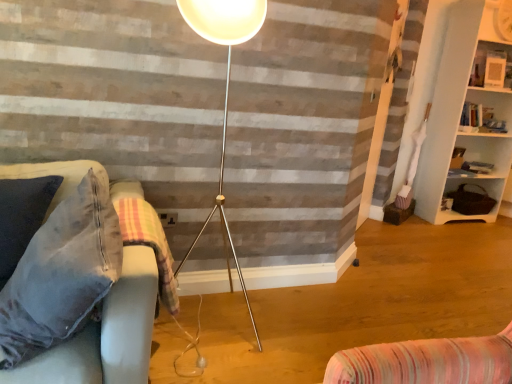
Question: Is the position of wooden textured basket at right, which ranks as the 3th shelf in top-to-bottom order, more distant than that of white glossy picture frame at upper right, which is the 3th shelf from bottom to top?

Choices:
 (A) no
 (B) yes

Answer: (B)

Question: Considering the relative sizes of wooden textured basket at right, positioned as the 1th shelf in bottom-to-top order, and white glossy picture frame at upper right, which is the 3th shelf from bottom to top, in the image provided, is wooden textured basket at right, positioned as the 1th shelf in bottom-to-top order, shorter than white glossy picture frame at upper right, which is the 3th shelf from bottom to top,?

Choices:
 (A) yes
 (B) no

Answer: (A)

Question: From the image's perspective, would you say wooden textured basket at right, which ranks as the 3th shelf in top-to-bottom order, is positioned over white glossy picture frame at upper right, which is counted as the 1th shelf, starting from the top?

Choices:
 (A) no
 (B) yes

Answer: (A)

Question: Does wooden textured basket at right, which ranks as the 3th shelf in top-to-bottom order, turn towards white glossy picture frame at upper right, which is the 3th shelf from bottom to top?

Choices:
 (A) no
 (B) yes

Answer: (A)

Question: Is wooden textured basket at right, positioned as the 1th shelf in bottom-to-top order, bigger than white glossy picture frame at upper right, which is counted as the 1th shelf, starting from the top?

Choices:
 (A) yes
 (B) no

Answer: (A)

Question: Considering the positions of point (111, 359) and point (145, 215), is point (111, 359) closer or farther from the camera than point (145, 215)?

Choices:
 (A) closer
 (B) farther

Answer: (A)

Question: In terms of width, does velvet fabric couch at left look wider or thinner when compared to plaid fabric blanket at lower left?

Choices:
 (A) wide
 (B) thin

Answer: (A)

Question: In terms of size, does velvet fabric couch at left appear bigger or smaller than plaid fabric blanket at lower left?

Choices:
 (A) small
 (B) big

Answer: (B)

Question: From a real-world perspective, relative to plaid fabric blanket at lower left, is velvet fabric couch at left vertically above or below?

Choices:
 (A) below
 (B) above

Answer: (B)

Question: Looking at their shapes, would you say wooden textured basket at right, positioned as the 1th shelf in bottom-to-top order, is wider or thinner than white matte bookshelf at right, the second shelf from the bottom?

Choices:
 (A) wide
 (B) thin

Answer: (B)

Question: Considering the relative positions of wooden textured basket at right, positioned as the 1th shelf in bottom-to-top order, and white matte bookshelf at right, the 2th shelf from the top, in the image provided, is wooden textured basket at right, positioned as the 1th shelf in bottom-to-top order, to the left or to the right of white matte bookshelf at right, the 2th shelf from the top,?

Choices:
 (A) left
 (B) right

Answer: (B)

Question: Relative to white matte bookshelf at right, the 2th shelf from the top, is wooden textured basket at right, which ranks as the 3th shelf in top-to-bottom order, in front or behind?

Choices:
 (A) behind
 (B) front

Answer: (A)

Question: In terms of height, does wooden textured basket at right, positioned as the 1th shelf in bottom-to-top order, look taller or shorter compared to white matte bookshelf at right, the second shelf from the bottom?

Choices:
 (A) short
 (B) tall

Answer: (A)

Question: Considering the positions of wooden textured basket at right, which ranks as the 3th shelf in top-to-bottom order, and plaid fabric blanket at lower left in the image, is wooden textured basket at right, which ranks as the 3th shelf in top-to-bottom order, taller or shorter than plaid fabric blanket at lower left?

Choices:
 (A) short
 (B) tall

Answer: (A)

Question: From a real-world perspective, is wooden textured basket at right, positioned as the 1th shelf in bottom-to-top order, physically located above or below plaid fabric blanket at lower left?

Choices:
 (A) below
 (B) above

Answer: (A)